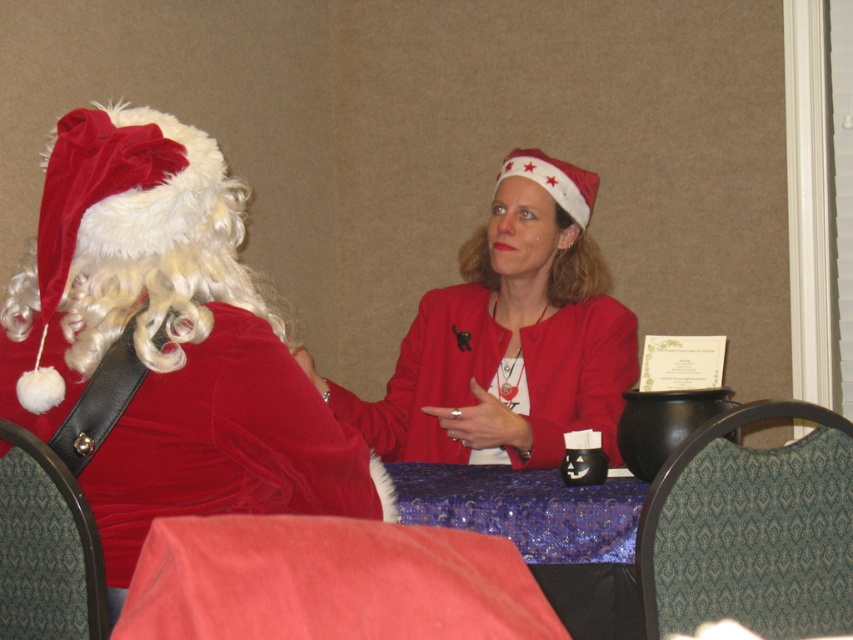
Can you confirm if velvet red chair at lower left is thinner than green fabric chair at lower right?

Correct, velvet red chair at lower left's width is less than green fabric chair at lower right's.

In order to click on velvet red chair at lower left in this screenshot , I will do `click(328, 580)`.

Can you confirm if velvet red chair at lower left is bigger than purple fabric table at center?

Incorrect, velvet red chair at lower left is not larger than purple fabric table at center.

Is velvet red chair at lower left further to camera compared to purple fabric table at center?

No, velvet red chair at lower left is closer to the viewer.

Is point (387, 557) farther from viewer compared to point (515, 531)?

No, it is in front of (515, 531).

Find the location of a particular element. The image size is (853, 640). velvet red chair at lower left is located at coordinates (328, 580).

Does velvet santa claus at left appear over green fabric chair at lower left?

Yes, velvet santa claus at left is above green fabric chair at lower left.

Can you confirm if velvet santa claus at left is thinner than green fabric chair at lower left?

In fact, velvet santa claus at left might be wider than green fabric chair at lower left.

Is point (70, 298) closer to viewer compared to point (10, 625)?

Yes.

Where is `velvet santa claus at left`? The image size is (853, 640). velvet santa claus at left is located at coordinates (167, 340).